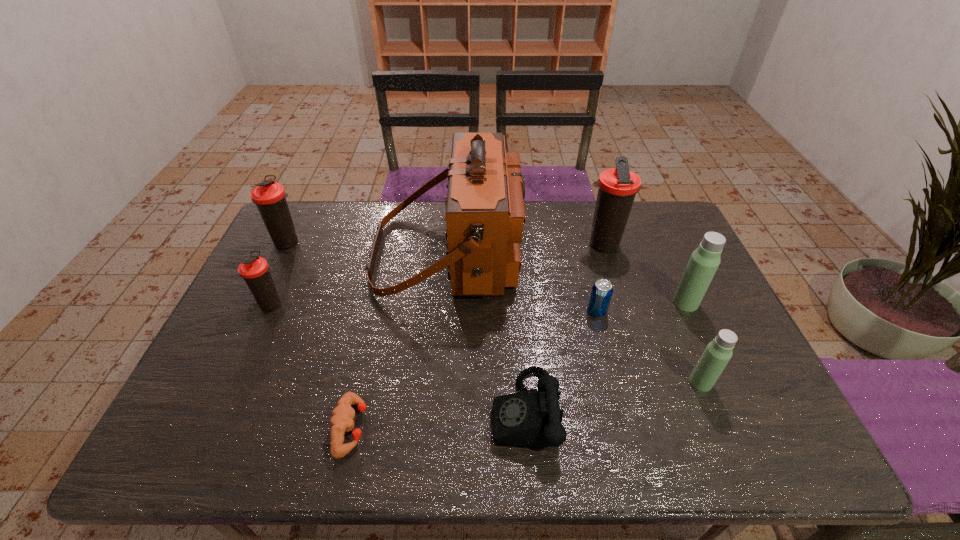
At what (x,y) coordinates should I click in order to perform the action: click on vacant space located 0.250m on the dial of the telephone. Please return your answer as a coordinate pair (x, y). Looking at the image, I should click on (384, 411).

Image resolution: width=960 pixels, height=540 pixels. Identify the location of vacant area situated 0.170m on the dial of the telephone. (x=420, y=411).

You are a GUI agent. You are given a task and a screenshot of the screen. Output one action in this format:
    pyautogui.click(x=<x>, y=<y>)
    Task: Click on the vacant space situated 0.380m on the dial of the telephone
    Image resolution: width=960 pixels, height=540 pixels.
    Given the screenshot: What is the action you would take?
    (328, 411)

At what (x,y) coordinates should I click in order to perform the action: click on free point located with the gloves of the red puncher facing forward. Please return your answer as a coordinate pair (x, y). Image resolution: width=960 pixels, height=540 pixels. Looking at the image, I should click on (411, 428).

Locate an element on the screen. satchel located at the far edge is located at coordinates (485, 213).

Where is `telephone located in the near edge section of the desktop`? The image size is (960, 540). telephone located in the near edge section of the desktop is located at coordinates (531, 418).

Where is `puncher present at the near edge`? This screenshot has height=540, width=960. puncher present at the near edge is located at coordinates (342, 417).

Locate an element on the screen. object at the far left corner is located at coordinates (270, 197).

In the image, there is a desktop. Where is `vacant space at the far edge`? The image size is (960, 540). vacant space at the far edge is located at coordinates (571, 206).

Locate an element on the screen. Image resolution: width=960 pixels, height=540 pixels. free spot at the near edge of the desktop is located at coordinates (662, 458).